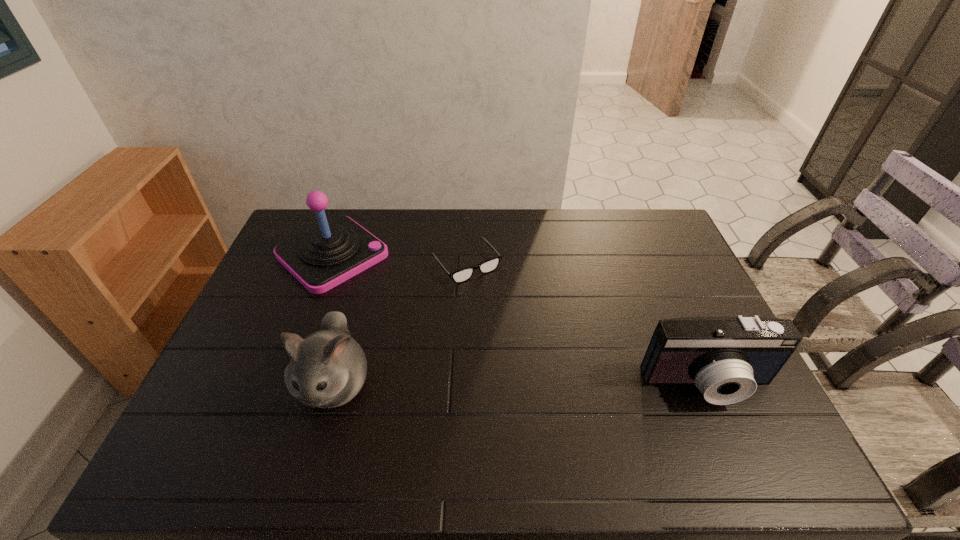
Identify the location of vacant space located forward from the base of the joystick. (445, 351).

Identify the location of spectacles present at the far edge. This screenshot has width=960, height=540. 462,275.

At what (x,y) coordinates should I click in order to perform the action: click on joystick situated at the far edge. Please return your answer as a coordinate pair (x, y). Looking at the image, I should click on (321, 258).

The width and height of the screenshot is (960, 540). What are the coordinates of `hamster that is at the near edge` in the screenshot? It's located at (328, 368).

Identify the location of camcorder that is at the near edge. (726, 358).

Where is `object positioned at the left edge`? The width and height of the screenshot is (960, 540). object positioned at the left edge is located at coordinates (321, 258).

Identify the location of object that is positioned at the right edge. (726, 358).

Locate an element on the screen. Image resolution: width=960 pixels, height=540 pixels. object located in the far left corner section of the desktop is located at coordinates (321, 258).

Locate an element on the screen. Image resolution: width=960 pixels, height=540 pixels. object at the near right corner is located at coordinates (726, 358).

In the image, there is a desktop. Identify the location of vacant area at the far edge. The height and width of the screenshot is (540, 960). (527, 219).